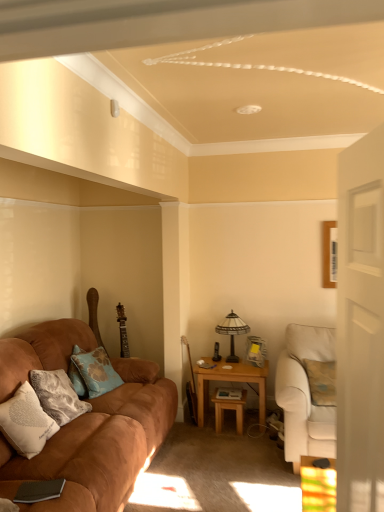
Locate an element on the screen. space that is in front of stained glass lampshade at center-right is located at coordinates (241, 368).